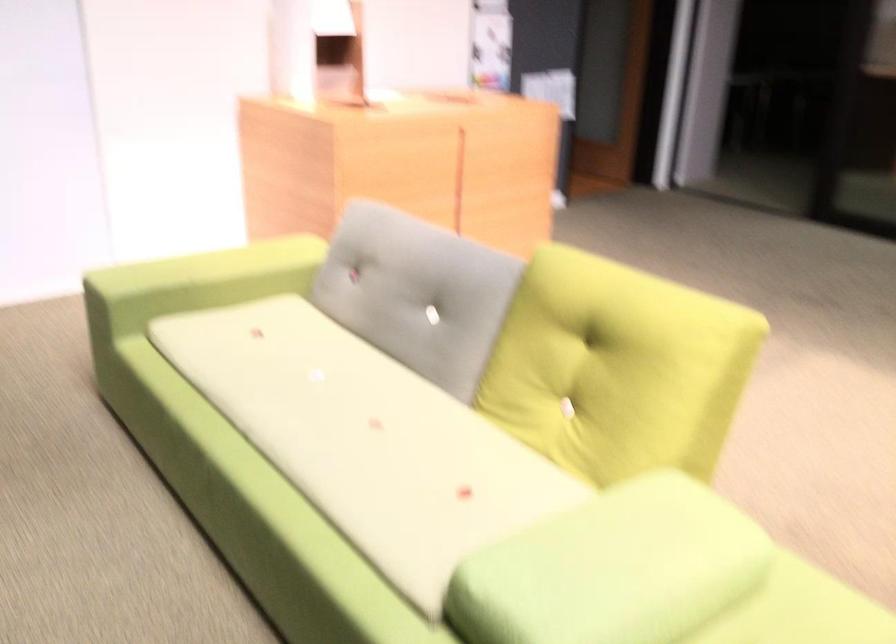
Where would you sit the light-colored sofa sitting surface? Please return your answer as a coordinate pair (x, y).

(366, 439)